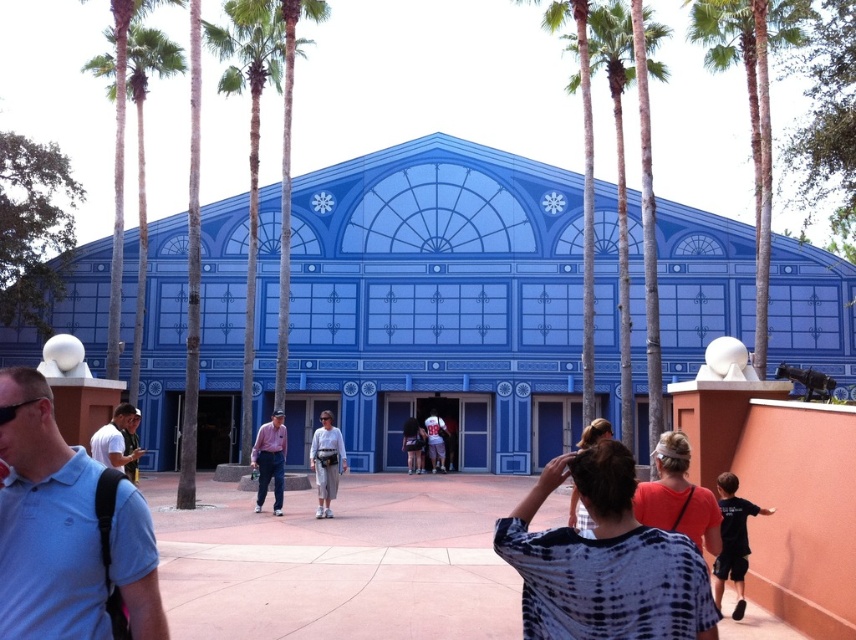
Question: Is orange t-shirt at center smaller than white jersey at center?

Choices:
 (A) yes
 (B) no

Answer: (B)

Question: Which object appears closest to the camera in this image?

Choices:
 (A) brown wood palm tree at center
 (B) denim shorts at center

Answer: (A)

Question: Is green leafy palm tree at upper right bigger than white fabric pants at center?

Choices:
 (A) no
 (B) yes

Answer: (B)

Question: Which point is farther to the camera?

Choices:
 (A) denim shorts at center
 (B) blue cotton polo shirt at left

Answer: (A)

Question: Can you confirm if pink shirt at center is positioned above white jersey at center?

Choices:
 (A) yes
 (B) no

Answer: (A)

Question: Among these objects, which one is farthest from the camera?

Choices:
 (A) black tie-dye shirt at center
 (B) green leafy palm tree at center
 (C) pink shirt at center

Answer: (B)